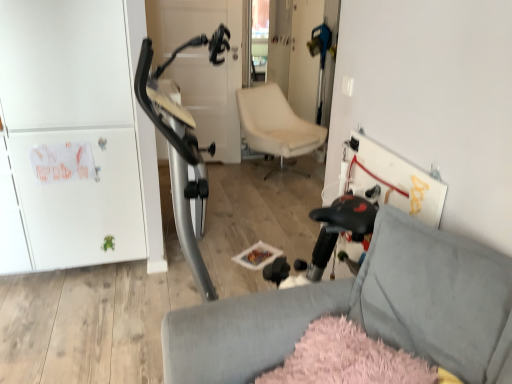
You are a GUI agent. You are given a task and a screenshot of the screen. Output one action in this format:
    pyautogui.click(x=<x>, y=<y>)
    Task: Click on the unoccupied area in front of white matte cabinet at left
    Image resolution: width=512 pixels, height=384 pixels.
    Given the screenshot: What is the action you would take?
    pyautogui.click(x=80, y=304)